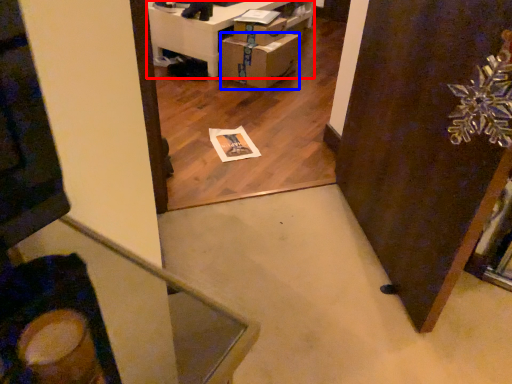
Question: Which of the following is the farthest to the observer, furniture (highlighted by a red box) or cardboard box (highlighted by a blue box)?

Choices:
 (A) furniture
 (B) cardboard box

Answer: (A)